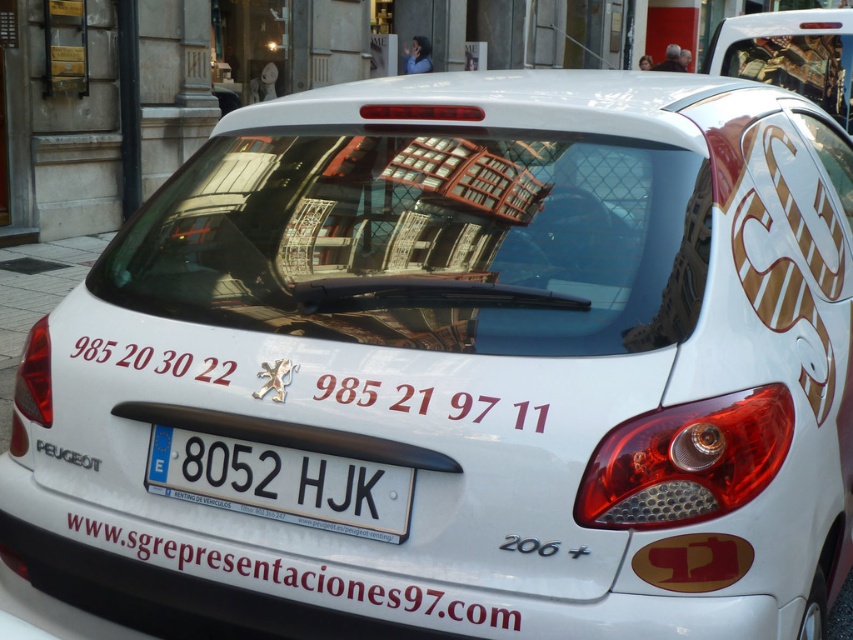
Between point (341, 524) and point (305, 579), which one is positioned behind?

The point (341, 524) is behind.

The image size is (853, 640). In order to click on white plastic license plate at center in this screenshot , I will do `click(281, 483)`.

Image resolution: width=853 pixels, height=640 pixels. What are the coordinates of `white plastic license plate at center` in the screenshot? It's located at (281, 483).